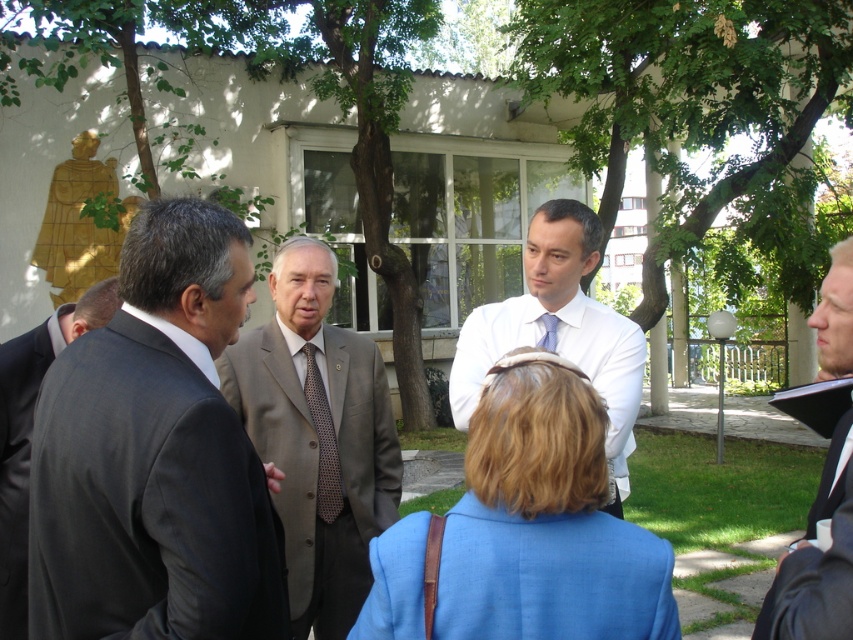
You are a photographer trying to capture a portrait of the white glossy shirt at center and the dark gray suit at left. Which subject should you focus on if you want to highlight the taller one?

The white glossy shirt at center is taller than the dark gray suit at left, so you should focus on the white glossy shirt at center to highlight the taller subject.

You are a photographer trying to capture a group photo of the two people wearing the brown textured suit at center and the white glossy shirt at center. Since you want to ensure both subjects are clearly visible, which subject should you position closer to the camera to avoid them being cut off due to their size difference?

The brown textured suit at center has a lesser width compared to the white glossy shirt at center, so you should position the brown textured suit at center closer to the camera to ensure both are visible in the frame.

You are a photographer trying to capture a closeup of the brown textured suit at center and the white glossy shirt at center. Since you want to focus on the smaller one, which one should you zoom in on?

The brown textured suit at center is smaller compared to the white glossy shirt at center, so you should zoom in on the brown textured suit at center to focus on the smaller one.